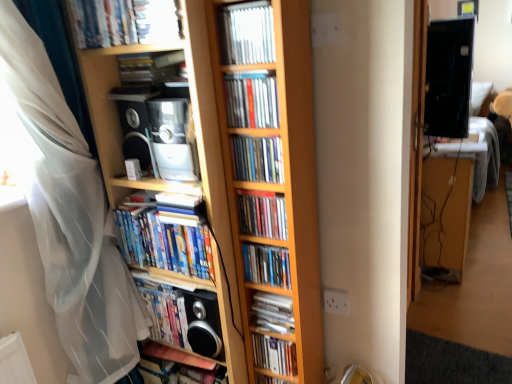
Question: Can you confirm if metallic silver cd at center, the 10th book in the bottom-to-top sequence, is wider than hardcover books at center, placed as the 6th book when sorted from bottom to top?

Choices:
 (A) no
 (B) yes

Answer: (A)

Question: Is metallic silver cd at center, the 10th book in the bottom-to-top sequence, at the left side of hardcover books at center, placed as the 6th book when sorted from bottom to top?

Choices:
 (A) no
 (B) yes

Answer: (A)

Question: Is metallic silver cd at center, the 10th book in the bottom-to-top sequence, turned away from hardcover books at center, placed as the 6th book when sorted from bottom to top?

Choices:
 (A) yes
 (B) no

Answer: (B)

Question: Considering the relative sizes of metallic silver cd at center, the 10th book in the bottom-to-top sequence, and hardcover books at center, placed as the 6th book when sorted from bottom to top, in the image provided, is metallic silver cd at center, the 10th book in the bottom-to-top sequence, taller than hardcover books at center, placed as the 6th book when sorted from bottom to top,?

Choices:
 (A) yes
 (B) no

Answer: (B)

Question: Is metallic silver cd at center, the 10th book in the bottom-to-top sequence, far from hardcover books at center, the 6th book positioned from the top?

Choices:
 (A) yes
 (B) no

Answer: (B)

Question: From a real-world perspective, relative to black glossy monitor at upper right, is wooden bookcase at center vertically above or below?

Choices:
 (A) above
 (B) below

Answer: (B)

Question: Is wooden bookcase at center taller or shorter than black glossy monitor at upper right?

Choices:
 (A) short
 (B) tall

Answer: (B)

Question: From the image's perspective, relative to black glossy monitor at upper right, is wooden bookcase at center above or below?

Choices:
 (A) below
 (B) above

Answer: (A)

Question: Based on their sizes in the image, would you say wooden bookcase at center is bigger or smaller than black glossy monitor at upper right?

Choices:
 (A) big
 (B) small

Answer: (A)

Question: Is point (291, 362) positioned closer to the camera than point (239, 115)?

Choices:
 (A) closer
 (B) farther

Answer: (B)

Question: Is matte plastic book at lower center, acting as the 10th book starting from the top, to the left or to the right of matte plastic book at center, which appears as the ninth book when ordered from the bottom, in the image?

Choices:
 (A) right
 (B) left

Answer: (A)

Question: Is matte plastic book at lower center, acting as the 10th book starting from the top, wider or thinner than matte plastic book at center, which appears as the ninth book when ordered from the bottom?

Choices:
 (A) thin
 (B) wide

Answer: (B)

Question: Would you say matte plastic book at lower center, acting as the 10th book starting from the top, is inside or outside matte plastic book at center, marked as the third book in a top-to-bottom arrangement?

Choices:
 (A) outside
 (B) inside

Answer: (A)

Question: Considering the positions of hardcover books at center, placed as the 6th book when sorted from bottom to top, and white sheer curtain at left in the image, is hardcover books at center, placed as the 6th book when sorted from bottom to top, bigger or smaller than white sheer curtain at left?

Choices:
 (A) small
 (B) big

Answer: (A)

Question: From their relative heights in the image, would you say hardcover books at center, the 6th book positioned from the top, is taller or shorter than white sheer curtain at left?

Choices:
 (A) tall
 (B) short

Answer: (B)